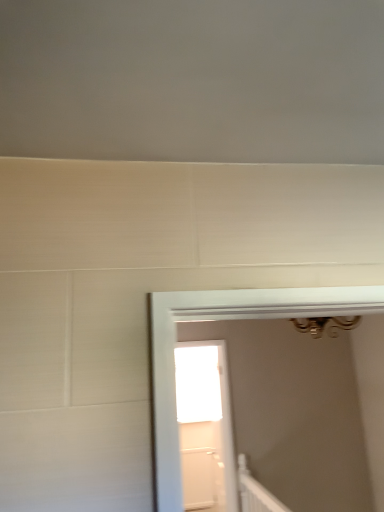
This screenshot has width=384, height=512. Describe the element at coordinates (197, 383) in the screenshot. I see `white frosted glass at upper center` at that location.

This screenshot has height=512, width=384. In order to click on white frosted glass at upper center in this screenshot , I will do `click(197, 383)`.

Where is `white frosted glass at upper center`? white frosted glass at upper center is located at coordinates (197, 383).